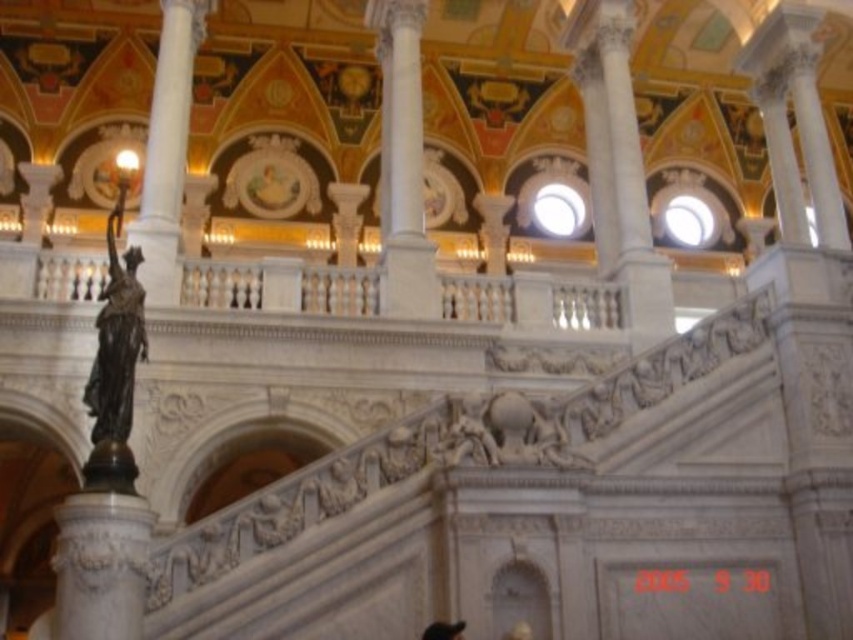
You are standing at the entrance of the grand hall and want to move towards the white marble column at center. Which direction should you walk to reach it?

The white marble column at center is located at point coordinates, so you should walk towards the center of the hall to reach it.

You are an architect visiting this grand space and notice the white marble column at upper center and the black hair at lower center. Which object is taller?

The white marble column at upper center is taller than the black hair at lower center.

You are standing at the base of the staircase in the grand hall and see the white marble column at center and the white marble column at upper center. Which column is positioned to the right when viewed from your perspective?

The white marble column at center is positioned to the right of the white marble column at upper center from your perspective.